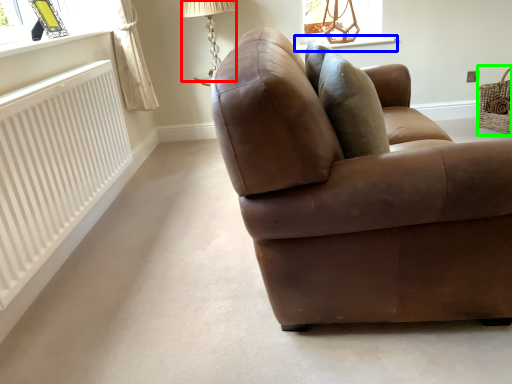
Question: Considering the real-world distances, which object is farthest from table lamp (highlighted by a red box)? window sill (highlighted by a blue box) or basket (highlighted by a green box)?

Choices:
 (A) window sill
 (B) basket

Answer: (B)